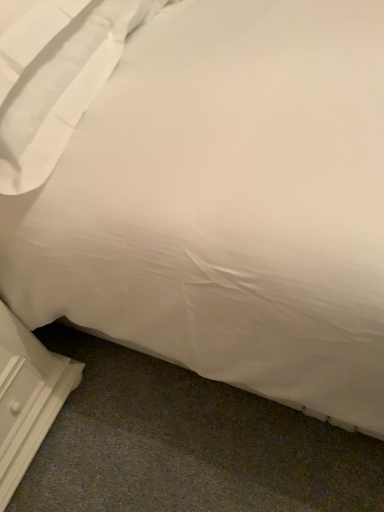
Question: Which is correct: white wood dresser at lower left is inside white smooth pillow at upper left, or outside of it?

Choices:
 (A) outside
 (B) inside

Answer: (A)

Question: From their relative heights in the image, would you say white wood dresser at lower left is taller or shorter than white smooth pillow at upper left?

Choices:
 (A) short
 (B) tall

Answer: (B)

Question: From a real-world perspective, relative to white smooth pillow at upper left, is white wood dresser at lower left vertically above or below?

Choices:
 (A) below
 (B) above

Answer: (A)

Question: Relative to white wood dresser at lower left, is white smooth pillow at upper left in front or behind?

Choices:
 (A) behind
 (B) front

Answer: (B)

Question: Is white smooth pillow at upper left situated inside white wood dresser at lower left or outside?

Choices:
 (A) inside
 (B) outside

Answer: (B)

Question: Looking at the image, does white smooth pillow at upper left seem bigger or smaller compared to white wood dresser at lower left?

Choices:
 (A) small
 (B) big

Answer: (B)

Question: Is point (11, 91) closer or farther from the camera than point (66, 388)?

Choices:
 (A) closer
 (B) farther

Answer: (A)